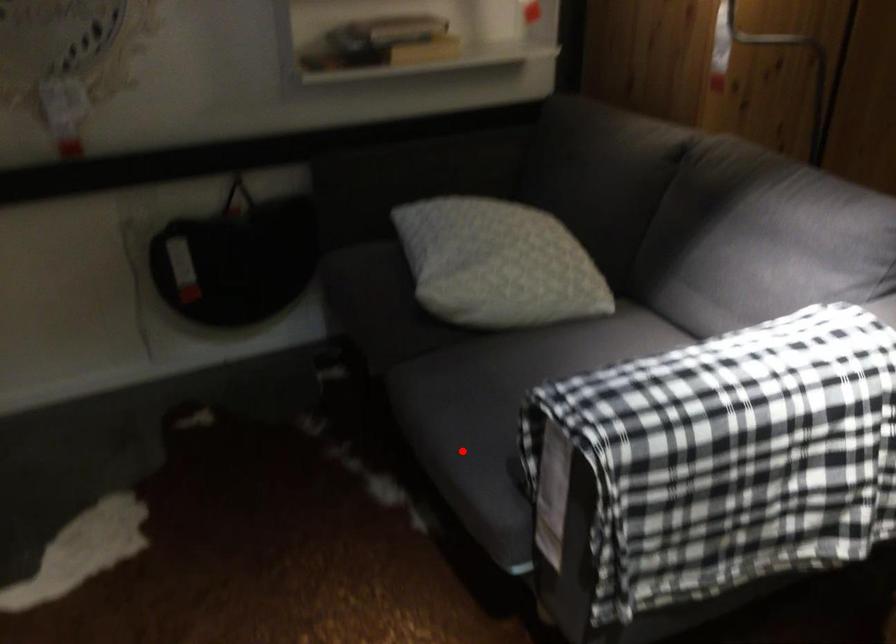
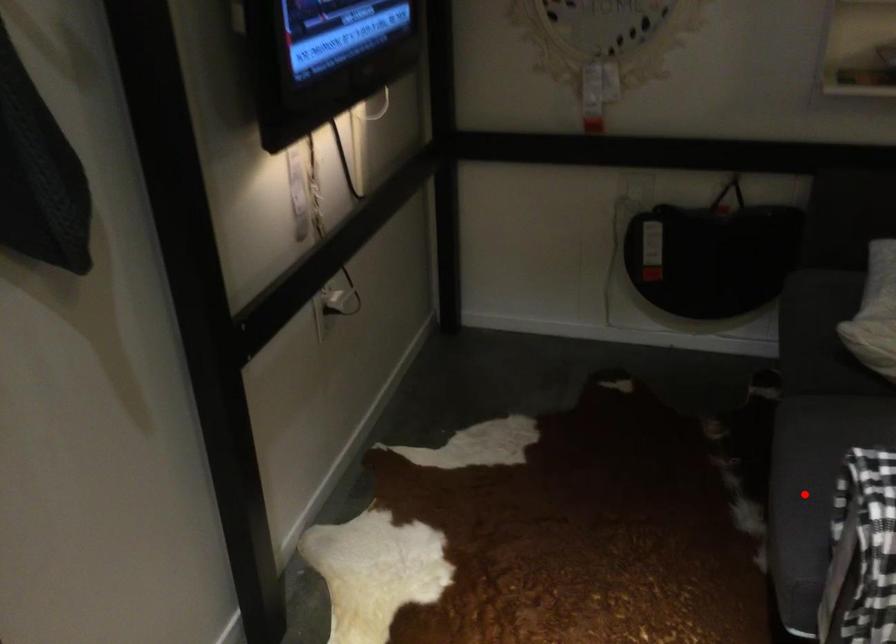
I am providing you with two images of the same scene from different viewpoints. A red point is marked on the first image and another point is marked on the second image. Does the point marked in image1 correspond to the same location as the one in image2?

Yes